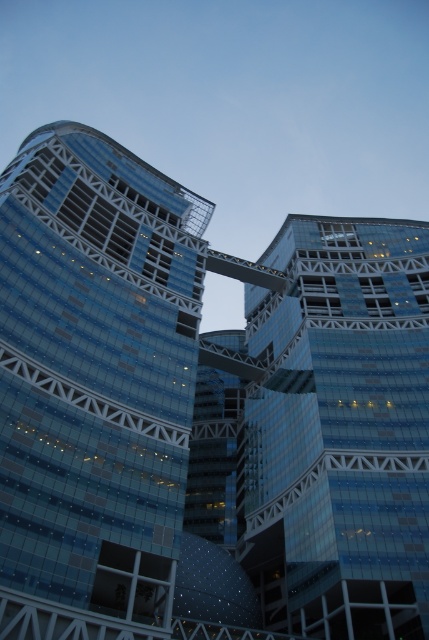
You are standing at the center of the bridge connecting the two buildings. Looking towards the transparent glass building at left, which direction should you turn to face it?

Since the transparent glass building at left is positioned at point (93,385), you should turn to your left to face it from the center of the bridge.

You are standing on the bridge between the two buildings and want to look down at the transparent glass building at left and the transparent glass building at center. Which building will you see more of when looking downward?

The transparent glass building at center will be visible more when looking downward because it is positioned below the transparent glass building at left.